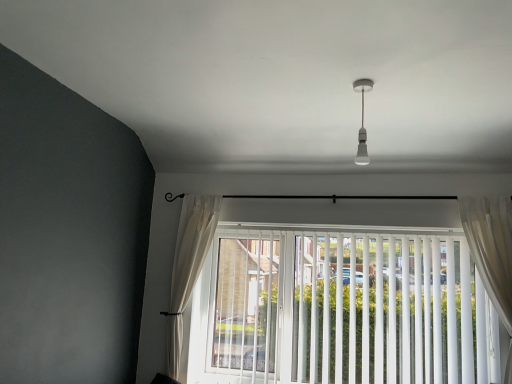
Question: From the image's perspective, is white sheer curtain at left, the first curtain when ordered from back to front, positioned above or below sheer white curtain at right, the 2th curtain in the left-to-right sequence?

Choices:
 (A) below
 (B) above

Answer: (A)

Question: Considering the positions of white sheer curtain at left, the 2th curtain viewed from the right, and sheer white curtain at right, which is the first curtain in right-to-left order, in the image, is white sheer curtain at left, the 2th curtain viewed from the right, taller or shorter than sheer white curtain at right, which is the first curtain in right-to-left order,?

Choices:
 (A) short
 (B) tall

Answer: (B)

Question: Estimate the real-world distances between objects in this image. Which object is farther from the white sheer curtain at left, the 2th curtain viewed from the right?

Choices:
 (A) white vertical blinds at center
 (B) white glossy bulb at upper center
 (C) sheer white curtain at right, which is the first curtain in right-to-left order

Answer: (C)

Question: Estimate the real-world distances between objects in this image. Which object is closer to the white glossy bulb at upper center?

Choices:
 (A) white vertical blinds at center
 (B) white sheer curtain at left, positioned as the first curtain in left-to-right order
 (C) sheer white curtain at right, which is the first curtain in right-to-left order

Answer: (C)